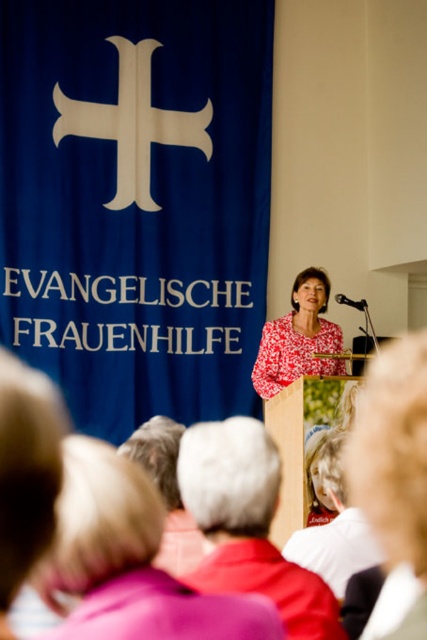
Question: Which point appears closest to the camera in this image?

Choices:
 (A) (131, 595)
 (B) (388, 344)

Answer: (A)

Question: Which is nearer to the blonde hair at center?

Choices:
 (A) floral fabric blouse at center
 (B) black plastic microphone at center
 (C) blonde hair at lower left
 (D) blue fabric banner at upper left

Answer: (C)

Question: Which of these objects is positioned farthest from the white hair at center?

Choices:
 (A) pink fabric at lower center
 (B) black plastic microphone at center

Answer: (B)

Question: Does blonde hair at lower left have a lesser width compared to black plastic microphone at center?

Choices:
 (A) no
 (B) yes

Answer: (A)

Question: Is the position of white hair at center less distant than that of blonde hair at lower left?

Choices:
 (A) no
 (B) yes

Answer: (A)

Question: Considering the relative positions of pink fabric at lower center and blonde hair at lower left in the image provided, where is pink fabric at lower center located with respect to blonde hair at lower left?

Choices:
 (A) above
 (B) below

Answer: (B)